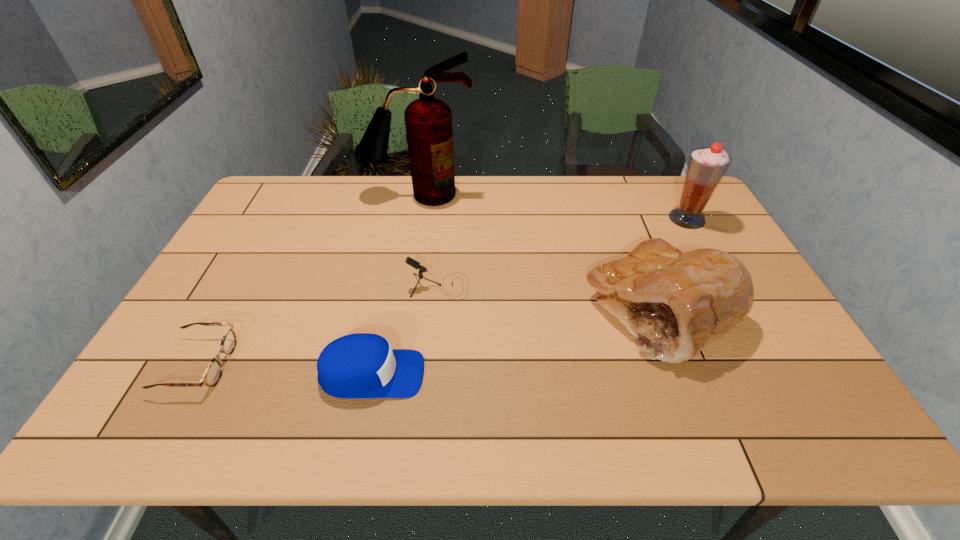
The width and height of the screenshot is (960, 540). Find the location of `free space between the baseball cap and the tallest object`. free space between the baseball cap and the tallest object is located at coordinates (396, 285).

This screenshot has height=540, width=960. I want to click on vacant space that is in between the baseball cap and the farthest object, so click(396, 285).

Locate an element on the screen. The height and width of the screenshot is (540, 960). vacant space that's between the leftmost object and the bread is located at coordinates (429, 338).

Image resolution: width=960 pixels, height=540 pixels. Find the location of `free space between the microphone and the baseball cap`. free space between the microphone and the baseball cap is located at coordinates (405, 330).

Where is `empty space that is in between the leftmost object and the fifth shortest object`? The image size is (960, 540). empty space that is in between the leftmost object and the fifth shortest object is located at coordinates (443, 292).

The width and height of the screenshot is (960, 540). Find the location of `object that is the fourth closest to the baseball cap`. object that is the fourth closest to the baseball cap is located at coordinates (428, 120).

Where is `object that ranks as the closest to the smoothie`? object that ranks as the closest to the smoothie is located at coordinates (675, 303).

I want to click on free space that satisfies the following two spatial constraints: 1. at the nozzle of the fire extinguisher; 2. on the frame of the shortest object, so click(390, 364).